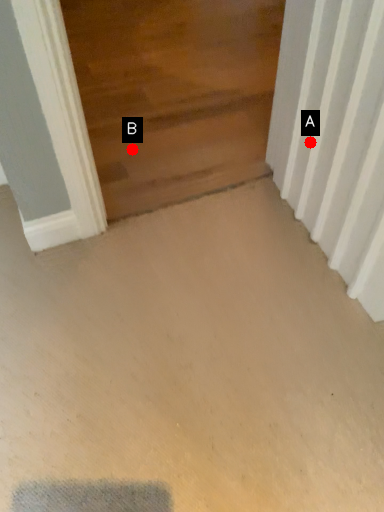
Question: Two points are circled on the image, labeled by A and B beside each circle. Among these points, which one is nearest to the camera?

Choices:
 (A) A is closer
 (B) B is closer

Answer: (A)